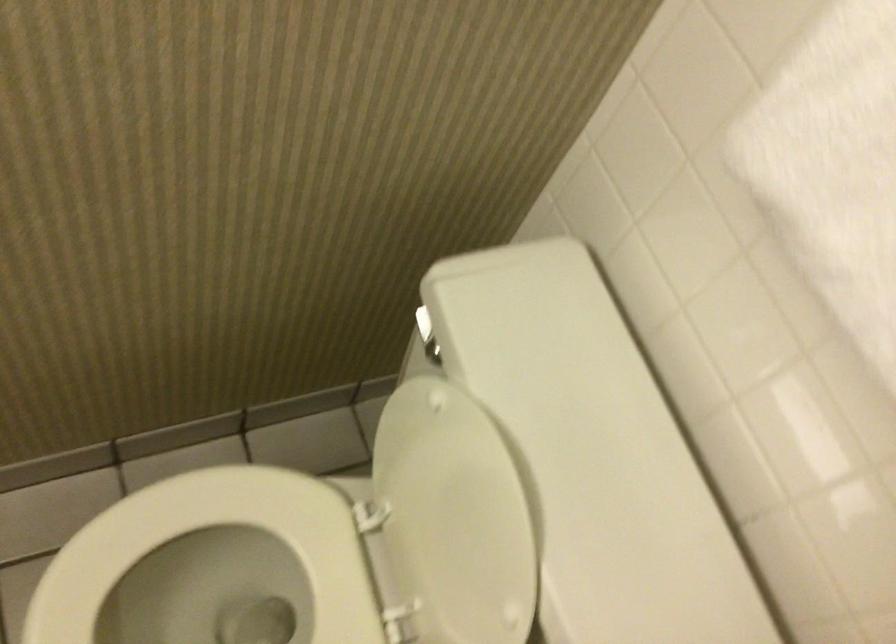
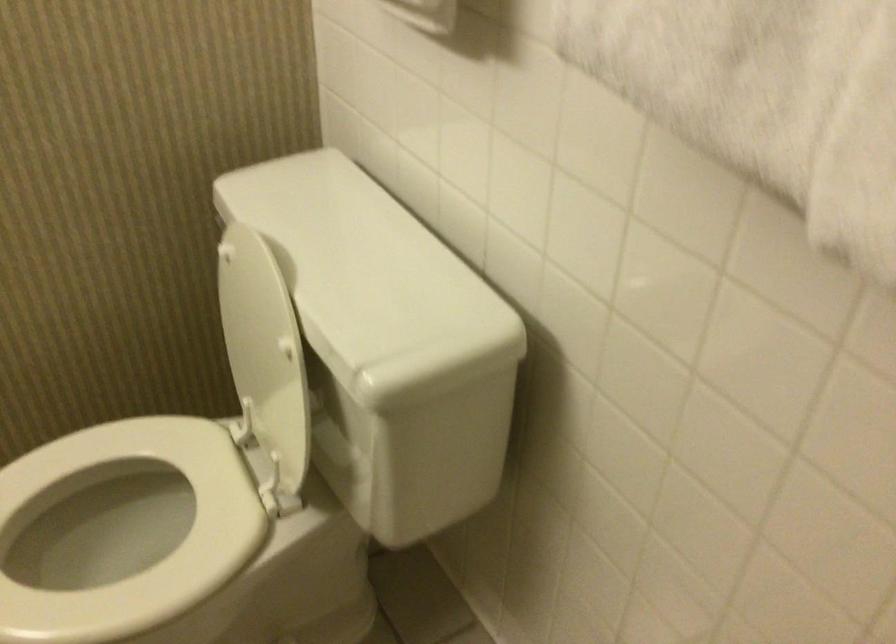
The point at (453,527) is marked in the first image. Where is the corresponding point in the second image?

(259, 343)